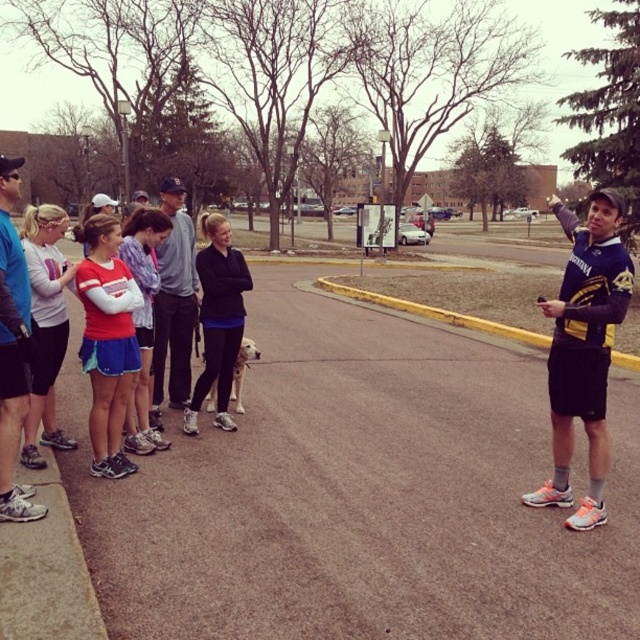
Question: Which point is closer to the camera?

Choices:
 (A) (170, 202)
 (B) (10, 284)

Answer: (B)

Question: Which of the following is the farthest from the observer?

Choices:
 (A) (170, 268)
 (B) (6, 232)

Answer: (A)

Question: From the image, what is the correct spatial relationship of blue fabric shirt at left in relation to dark gray sweatshirt at center?

Choices:
 (A) left
 (B) right

Answer: (A)

Question: Does blue fabric shirt at left appear on the right side of dark gray sweatshirt at center?

Choices:
 (A) yes
 (B) no

Answer: (B)

Question: Can you confirm if blue fabric shirt at left is positioned to the right of dark gray sweatshirt at center?

Choices:
 (A) no
 (B) yes

Answer: (A)